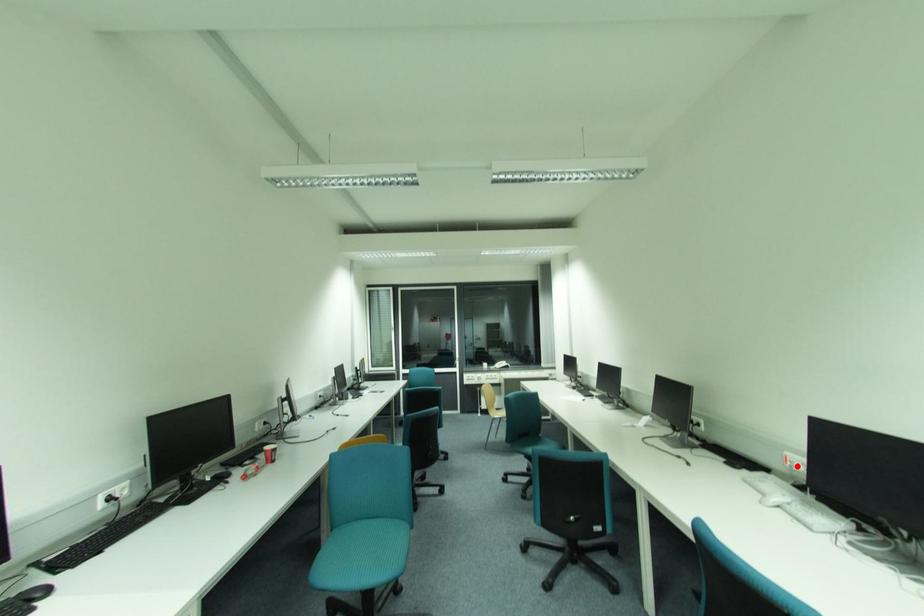
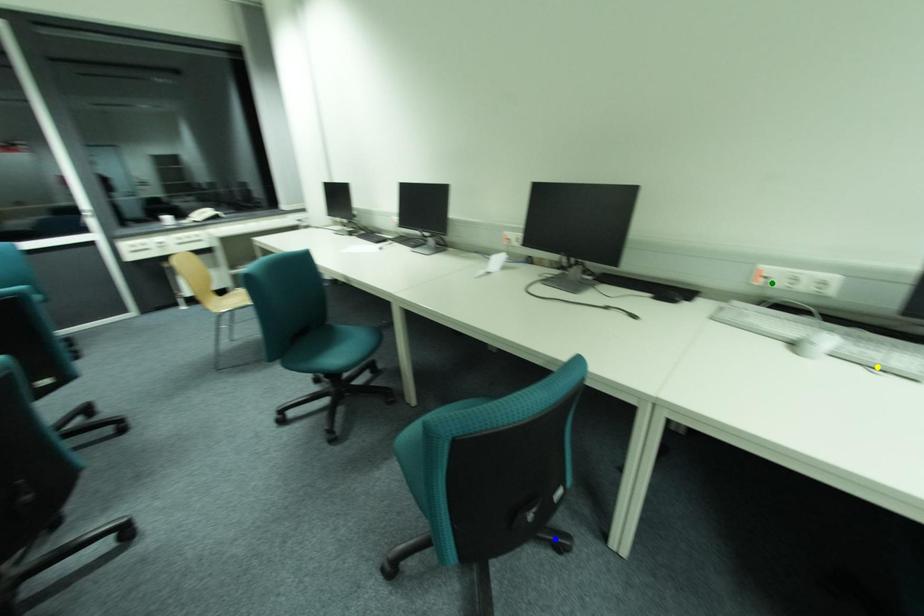
Question: I am providing you with two images of the same scene from different viewpoints. A red point is marked on the first image. You are given multiple points on the second image. Can you choose the point in image 2 that corresponds to the point in image 1?

Choices:
 (A) green point
 (B) yellow point
 (C) blue point

Answer: (A)